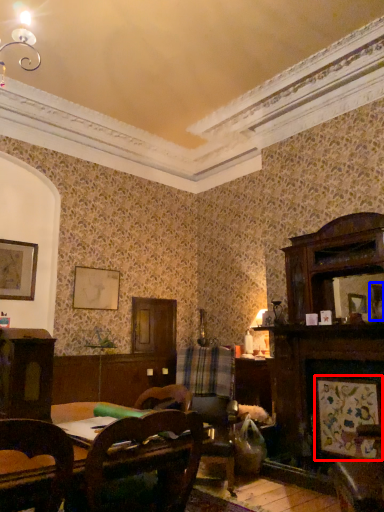
Question: Among these objects, which one is farthest to the camera, picture frame (highlighted by a red box) or picture frame (highlighted by a blue box)?

Choices:
 (A) picture frame
 (B) picture frame

Answer: (B)